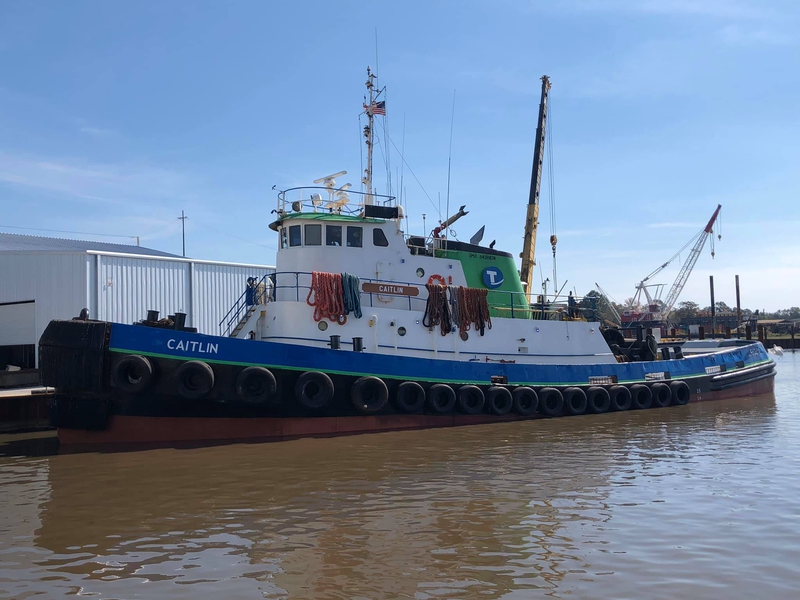
At what (x,y) coordinates should I click in order to perform the action: click on wall. Please return your answer as a coordinate pair (x, y). This screenshot has height=600, width=800. Looking at the image, I should click on (125, 283).